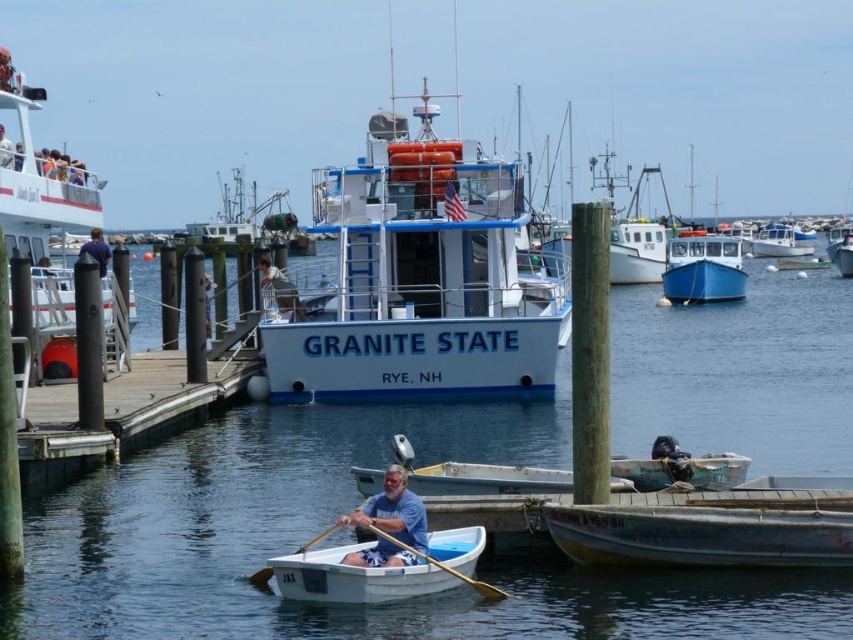
Does point (756, 253) come behind point (312, 544)?

Yes, point (756, 253) is behind point (312, 544).

Who is higher up, white fiberglass boat at center or wooden at left?

white fiberglass boat at center is higher up.

Does point (779, 241) lie in front of point (268, 566)?

That is False.

Identify the location of white fiberglass boat at center. This screenshot has width=853, height=640. pos(778,243).

Who is higher up, white wooden canoe at lower right or blue matte boat at center?

blue matte boat at center is higher up.

Who is more forward, (608,552) or (735,244)?

Point (608,552) is in front.

Who is more forward, (805, 532) or (670, 252)?

Point (805, 532) is in front.

You are a GUI agent. You are given a task and a screenshot of the screen. Output one action in this format:
    pyautogui.click(x=<x>, y=<y>)
    Task: Click on the white wooden canoe at lower right
    This screenshot has width=853, height=640.
    Given the screenshot: What is the action you would take?
    pyautogui.click(x=700, y=536)

Is point (422, 513) positioned in front of point (207, 321)?

Yes, point (422, 513) is in front of point (207, 321).

Is point (416, 529) positioned behind point (212, 285)?

No.

Locate an element on the screen. The width and height of the screenshot is (853, 640). blue cotton shirt at center is located at coordinates (390, 524).